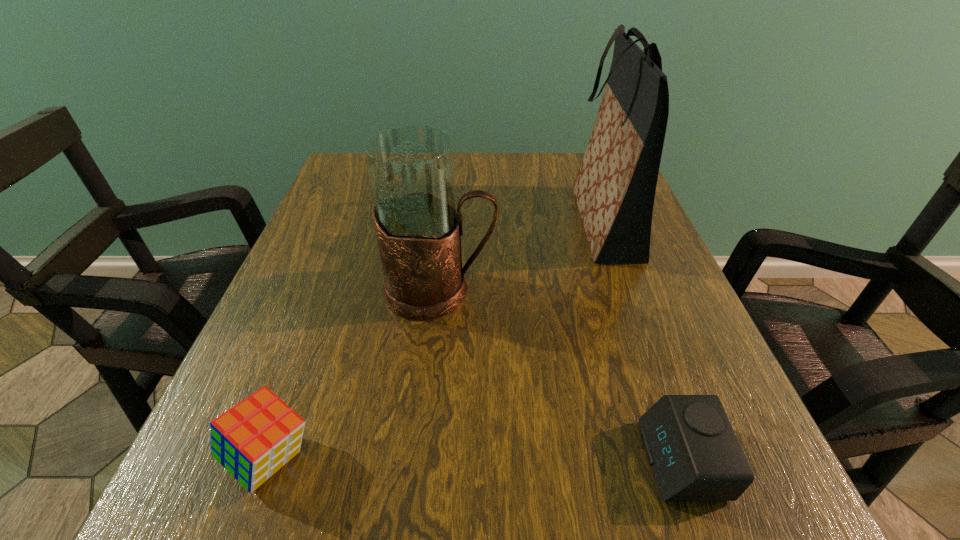
Locate an element on the screen. This screenshot has width=960, height=540. vacant region located 0.180m on the back of the cube is located at coordinates (319, 324).

Identify the location of vacant space located 0.380m on the front-facing side of the shortest object. The image size is (960, 540). (352, 460).

This screenshot has width=960, height=540. I want to click on vacant region located on the front-facing side of the shortest object, so click(468, 460).

Locate an element on the screen. The height and width of the screenshot is (540, 960). free space located 0.220m on the front-facing side of the shortest object is located at coordinates (476, 460).

Identify the location of object that is at the far edge. The width and height of the screenshot is (960, 540). [x=614, y=189].

At what (x,y) coordinates should I click in order to perform the action: click on cube situated at the near edge. Please return your answer as a coordinate pair (x, y). Looking at the image, I should click on (254, 439).

At what (x,y) coordinates should I click in order to perform the action: click on alarm clock present at the near edge. Please return your answer as a coordinate pair (x, y). This screenshot has width=960, height=540. Looking at the image, I should click on (694, 454).

What are the coordinates of `object that is positioned at the left edge` in the screenshot? It's located at (254, 439).

Locate an element on the screen. Image resolution: width=960 pixels, height=540 pixels. shopping bag at the right edge is located at coordinates (614, 189).

I want to click on alarm clock present at the right edge, so click(x=694, y=454).